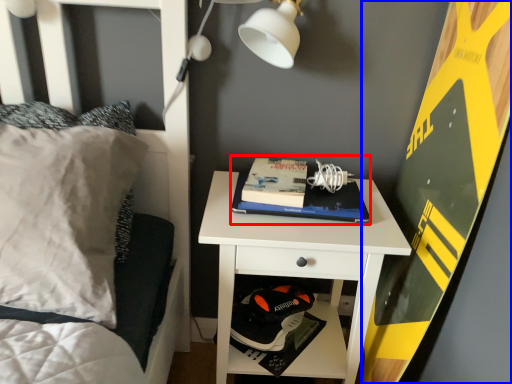
Question: Among these objects, which one is farthest to the camera, paperback book (highlighted by a red box) or bulletin board (highlighted by a blue box)?

Choices:
 (A) paperback book
 (B) bulletin board

Answer: (A)